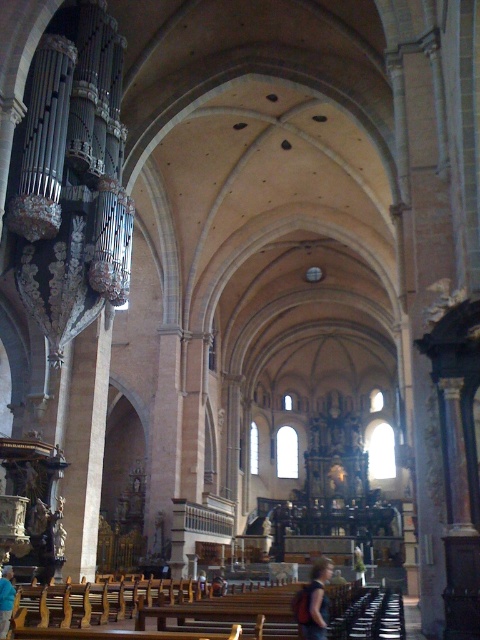
You are a visitor to the cathedral and you want to sit on the wooden pew. You see the dark brown leather jacket at lower center and the blue fabric shirt at lower left. Which one is wider?

The dark brown leather jacket at lower center might be wider than the blue fabric shirt at lower left.

Based on the photo, you are standing in the cathedral and notice two items on the floor. The dark brown leather jacket at lower center and the blue fabric shirt at lower left. Which item is closer to you?

The dark brown leather jacket at lower center is closer to you because it is in front of the blue fabric shirt at lower left.